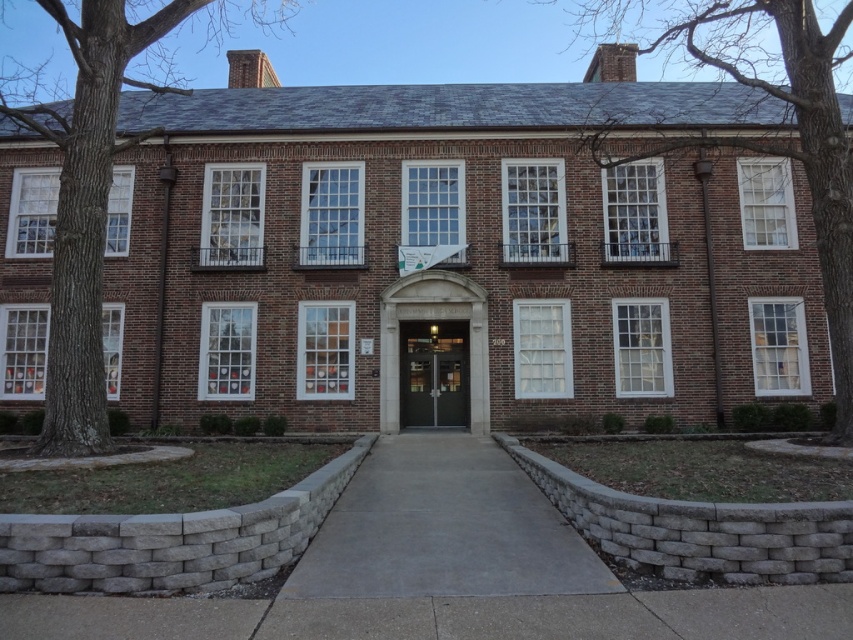
You are a delivery person standing in front of the building and need to place a large package on the ground. The package is as big as the matte gray door at center. Is there enough space on the gray concrete pavement at center to place it without overlapping the door?

The gray concrete pavement at center is smaller than the matte gray door at center. Therefore, the package cannot be placed on the gray concrete pavement at center without overlapping the door.

You are a delivery person trying to park your 2.5 meter wide delivery van. You see the gray concrete pavement at center and the matte gray door at center. Which area can accommodate the van?

The matte gray door at center has a width greater than the gray concrete pavement at center. Since the van is 2.5 meters wide, the matte gray door at center is the only area that can accommodate the van.

You are standing in front of the two story brick building. You see the gray concrete pavement at center and the matte gray door at center. Which one is lower in height?

The gray concrete pavement at center has a lesser height compared to matte gray door at center.